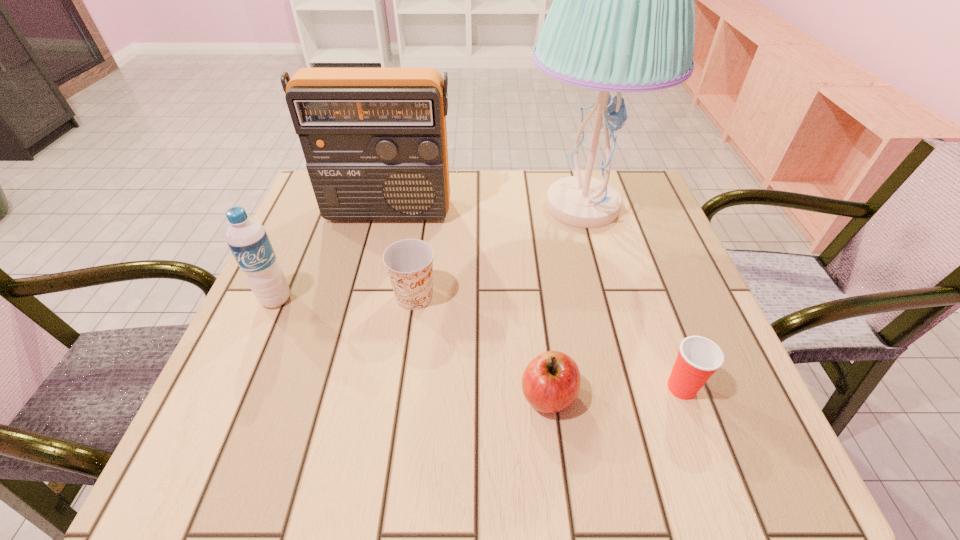
Locate an element on the screen. The image size is (960, 540). vacant area that satisfies the following two spatial constraints: 1. on the front-facing side of the second tallest object; 2. on the left side of the left Dixie cup is located at coordinates (367, 296).

Locate an element on the screen. free point that satisfies the following two spatial constraints: 1. on the front-facing side of the right Dixie cup; 2. on the right side of the second tallest object is located at coordinates 345,388.

The width and height of the screenshot is (960, 540). I want to click on vacant region that satisfies the following two spatial constraints: 1. on the front-facing side of the fifth shortest object; 2. on the left side of the right Dixie cup, so point(345,388).

I want to click on blank area in the image that satisfies the following two spatial constraints: 1. on the front-facing side of the farther Dixie cup; 2. on the right side of the fifth shortest object, so click(367, 296).